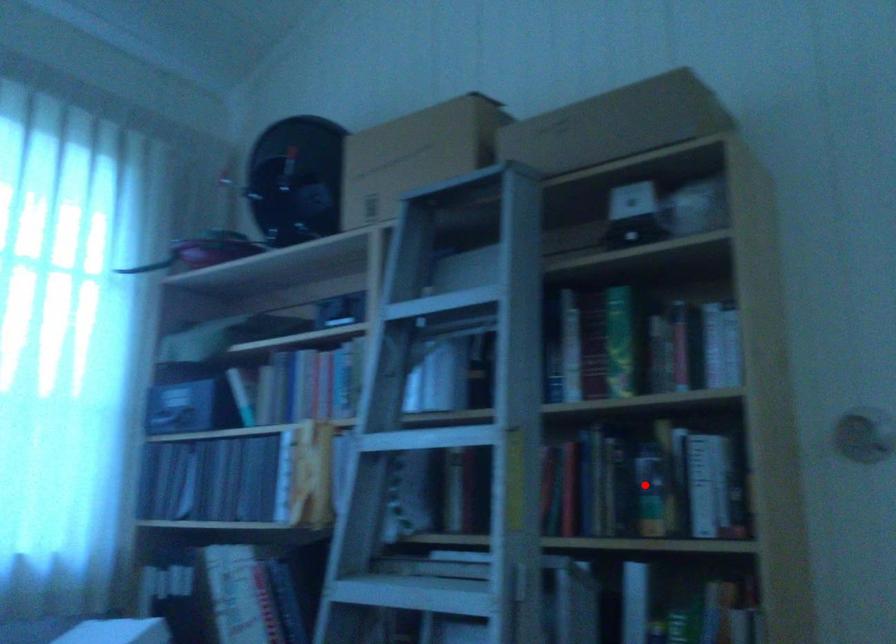
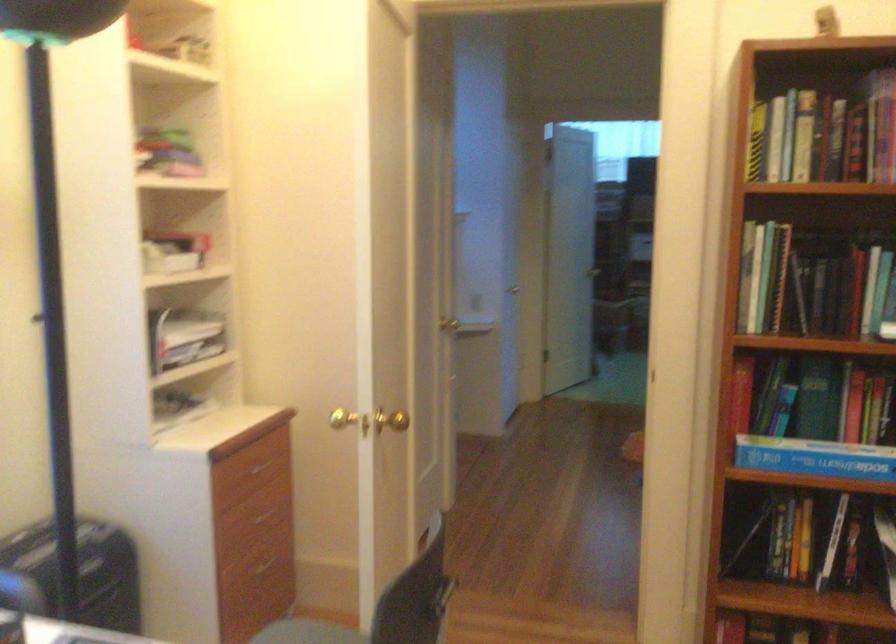
Question: I am providing you with two images of the same scene from different viewpoints. A red point is marked on the first image. Can you still see the location of the red point in image 2?

Choices:
 (A) Yes
 (B) No

Answer: (B)